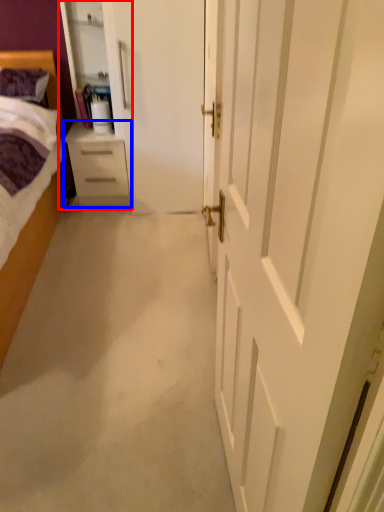
Question: Which of the following is the farthest to the observer, armoire (highlighted by a red box) or chest of drawers (highlighted by a blue box)?

Choices:
 (A) armoire
 (B) chest of drawers

Answer: (B)